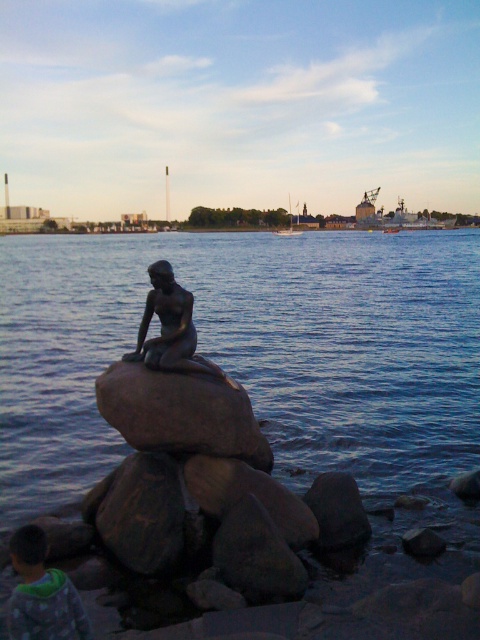
Question: Which point is farther to the camera?

Choices:
 (A) (33, 608)
 (B) (103, 416)

Answer: (B)

Question: Where is blue water at center located in relation to camouflage-patterned shirt at lower left in the image?

Choices:
 (A) above
 (B) below

Answer: (A)

Question: Can you confirm if brown rough rock at center is thinner than bronze statue at center?

Choices:
 (A) yes
 (B) no

Answer: (B)

Question: Which object is positioned farthest from the camouflage-patterned shirt at lower left?

Choices:
 (A) blue water at center
 (B) brown rough rock at center
 (C) bronze statue at center

Answer: (A)

Question: Estimate the real-world distances between objects in this image. Which object is closer to the camouflage-patterned shirt at lower left?

Choices:
 (A) blue water at center
 (B) bronze statue at center

Answer: (B)

Question: Where is blue water at center located in relation to camouflage-patterned shirt at lower left in the image?

Choices:
 (A) below
 (B) above

Answer: (B)